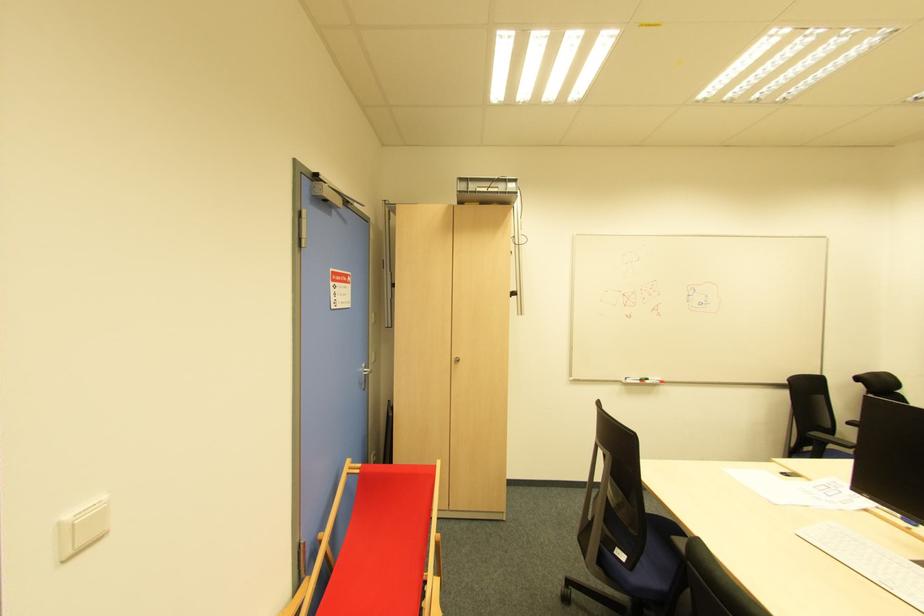
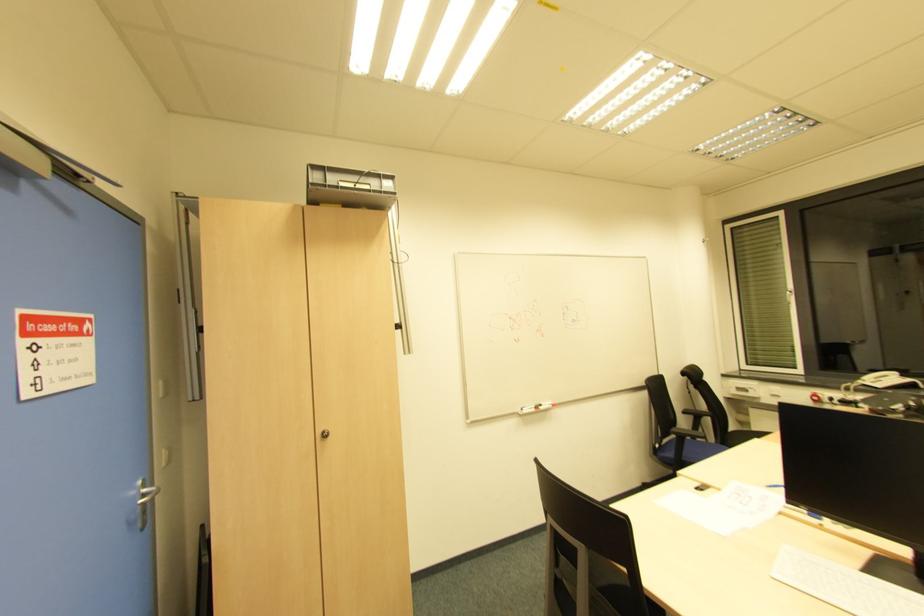
Question: The camera is either moving clockwise (left) or counter-clockwise (right) around the object. The first image is from the beginning of the video and the second image is from the end. Is the camera moving left or right when shooting the video?

Choices:
 (A) Left
 (B) Right

Answer: (A)